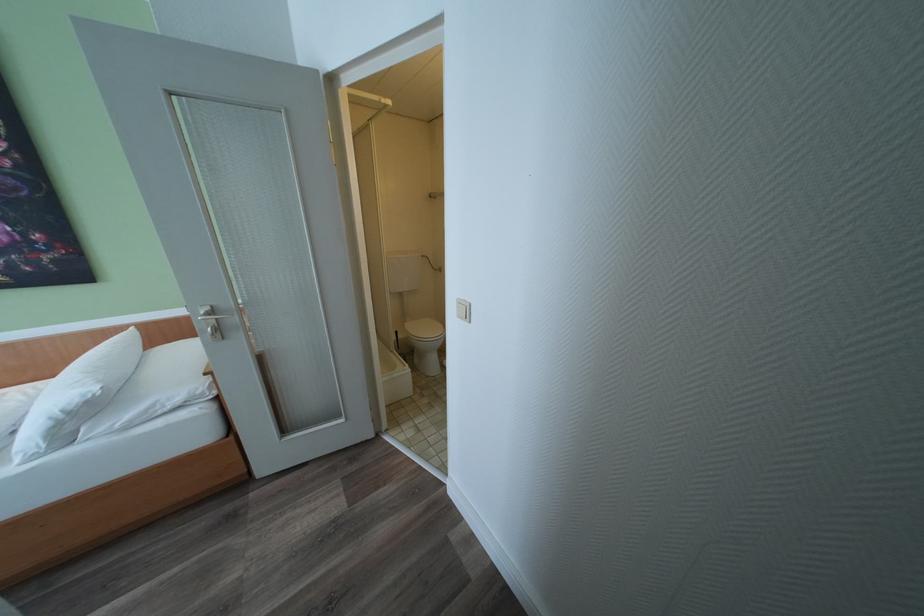
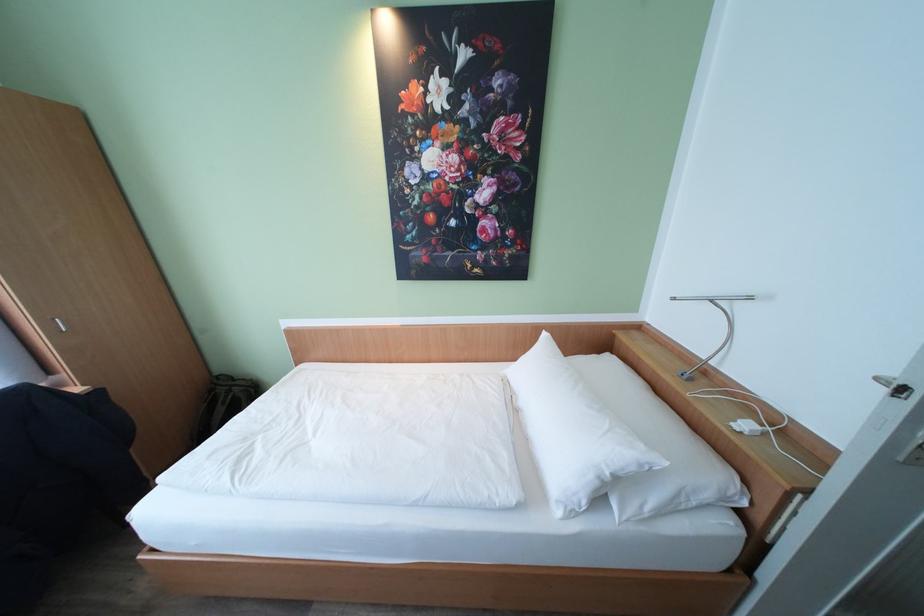
The point at (204, 391) is marked in the first image. Where is the corresponding point in the second image?

(736, 488)